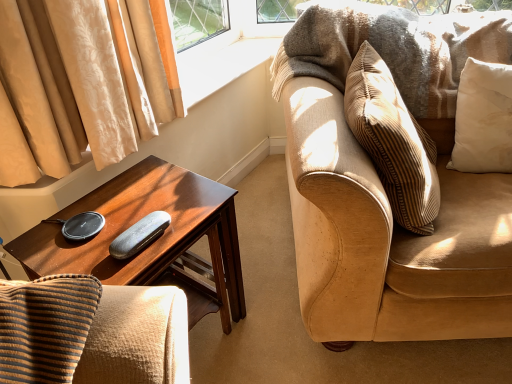
Identify the location of free space behind black textured case at center. The image size is (512, 384). (155, 194).